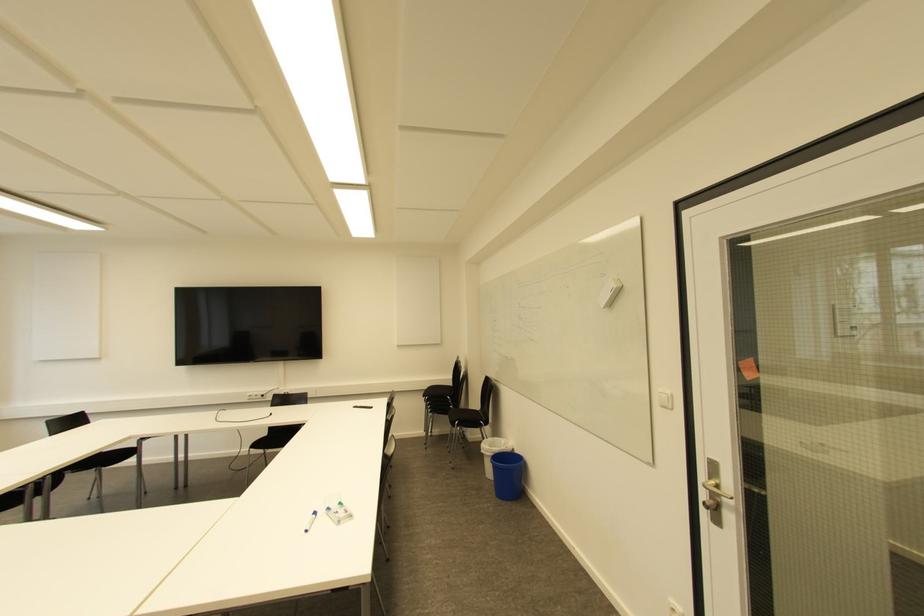
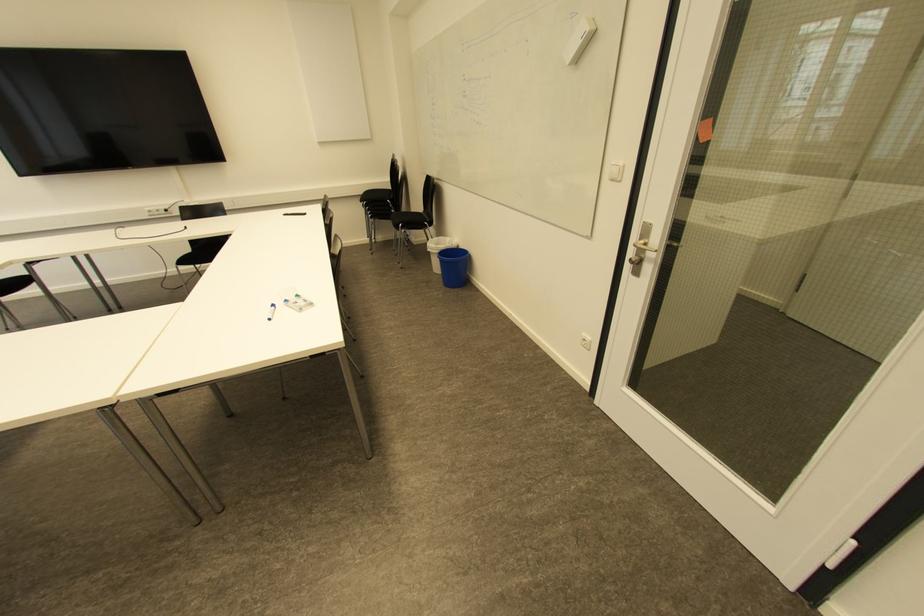
Where in the second image is the point corresponding to [516,451] from the first image?

(460, 246)